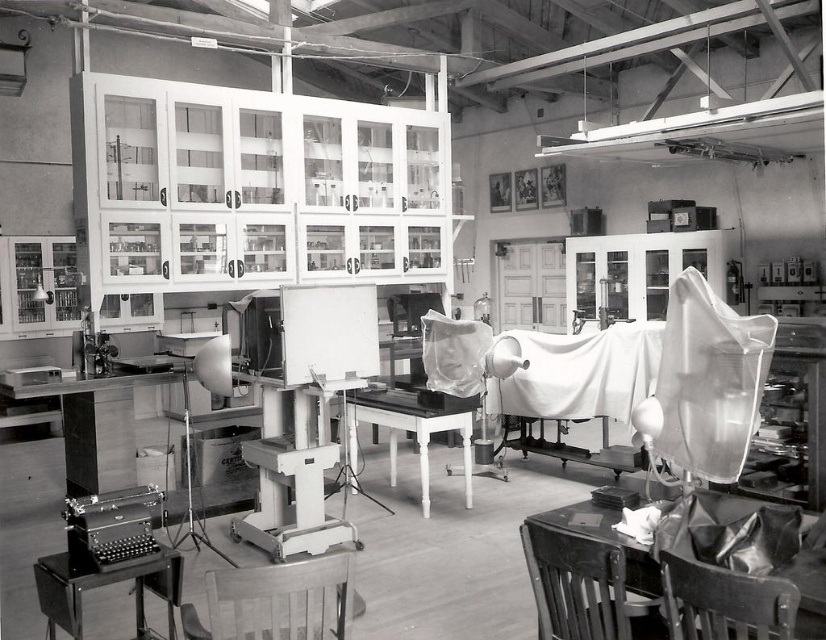
Question: Which of the following is the farthest from the observer?

Choices:
 (A) wooden chair at lower center
 (B) wooden chair at lower right
 (C) dark wood chair at lower right
 (D) metallic gray typewriter at lower left

Answer: (D)

Question: Does wooden chair at lower center appear on the right side of metallic gray typewriter at lower left?

Choices:
 (A) yes
 (B) no

Answer: (A)

Question: Is metallic gray typewriter at lower left to the left of smooth white table at center from the viewer's perspective?

Choices:
 (A) no
 (B) yes

Answer: (B)

Question: Which object is the farthest from the wooden chair at lower center?

Choices:
 (A) smooth dark wood table at lower right
 (B) metallic gray typewriter at lower left

Answer: (A)

Question: Among these points, which one is nearest to the camera?

Choices:
 (A) (577, 538)
 (B) (293, 621)
 (C) (596, 538)

Answer: (B)

Question: Is metallic gray typewriter at lower left above smooth white table at center?

Choices:
 (A) yes
 (B) no

Answer: (B)